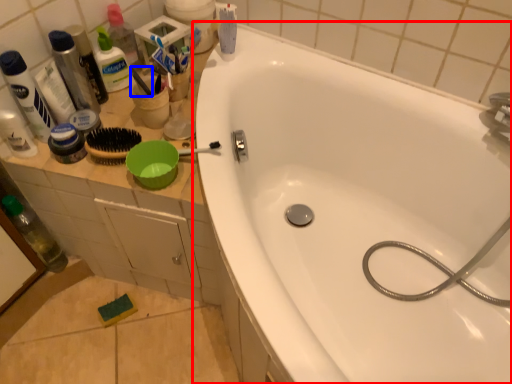
Question: Which of the following is the farthest to the observer, bathtub (highlighted by a red box) or brush (highlighted by a blue box)?

Choices:
 (A) bathtub
 (B) brush

Answer: (B)